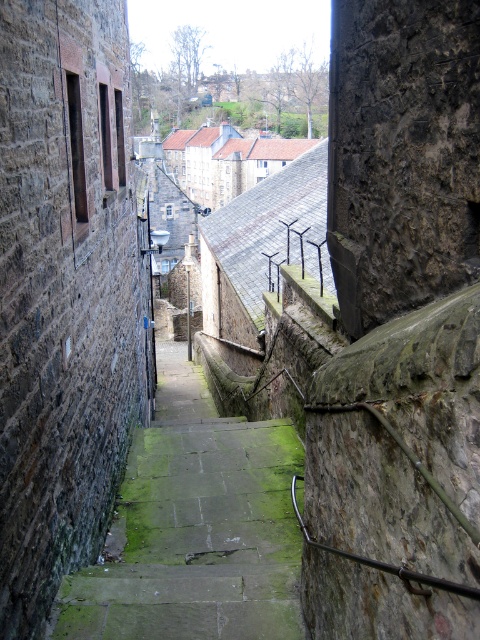
Question: Which of the following is the closest to the observer?

Choices:
 (A) (169, 214)
 (B) (118, 161)
 (C) (120, 628)

Answer: (C)

Question: Which object appears farthest from the camera in this image?

Choices:
 (A) clear glass window at upper center
 (B) brown wooden window at upper left
 (C) green mossy stone steps at center

Answer: (A)

Question: Can you confirm if green mossy stone steps at center is positioned above brown wooden window at upper left?

Choices:
 (A) no
 (B) yes

Answer: (A)

Question: Does green mossy stone steps at center appear on the left side of brown wooden window at upper left?

Choices:
 (A) yes
 (B) no

Answer: (B)

Question: From the image, what is the correct spatial relationship of green mossy stone steps at center in relation to brown wooden window at upper left?

Choices:
 (A) right
 (B) left

Answer: (A)

Question: Based on their relative distances, which object is nearer to the clear glass window at upper center?

Choices:
 (A) green mossy stone steps at center
 (B) brown wooden window at upper left

Answer: (A)